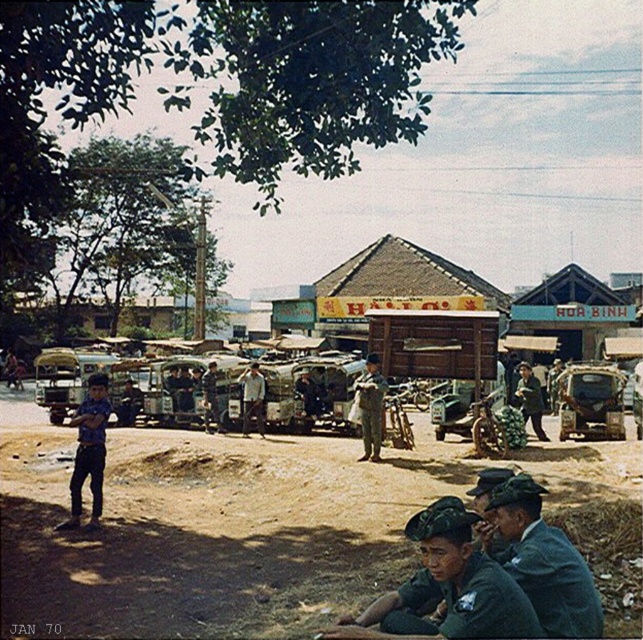
Is brown sandy dirt field at center positioned at the back of dark green uniform at center?

No, brown sandy dirt field at center is closer to the viewer.

Which of these two, brown sandy dirt field at center or dark green uniform at center, stands shorter?

With less height is brown sandy dirt field at center.

Is point (255, 442) less distant than point (521, 364)?

Yes, point (255, 442) is closer to viewer.

What are the coordinates of `brown sandy dirt field at center` in the screenshot? It's located at 210,529.

Does brown sandy dirt field at center lie in front of light brown uniform at center?

Yes, brown sandy dirt field at center is in front of light brown uniform at center.

Does brown sandy dirt field at center have a greater width compared to light brown uniform at center?

Yes, brown sandy dirt field at center is wider than light brown uniform at center.

Measure the distance between point (201, 433) and camera.

Point (201, 433) is 68.84 feet away from camera.

Where is `brown sandy dirt field at center`? Image resolution: width=643 pixels, height=640 pixels. brown sandy dirt field at center is located at coordinates (210, 529).

Who is more forward, (24, 481) or (572, 380)?

Point (24, 481) is more forward.

Between brown sandy dirt field at center and camouflage fabric jeep at center, which one appears on the right side from the viewer's perspective?

From the viewer's perspective, camouflage fabric jeep at center appears more on the right side.

Locate an element on the screen. This screenshot has width=643, height=640. brown sandy dirt field at center is located at coordinates (210, 529).